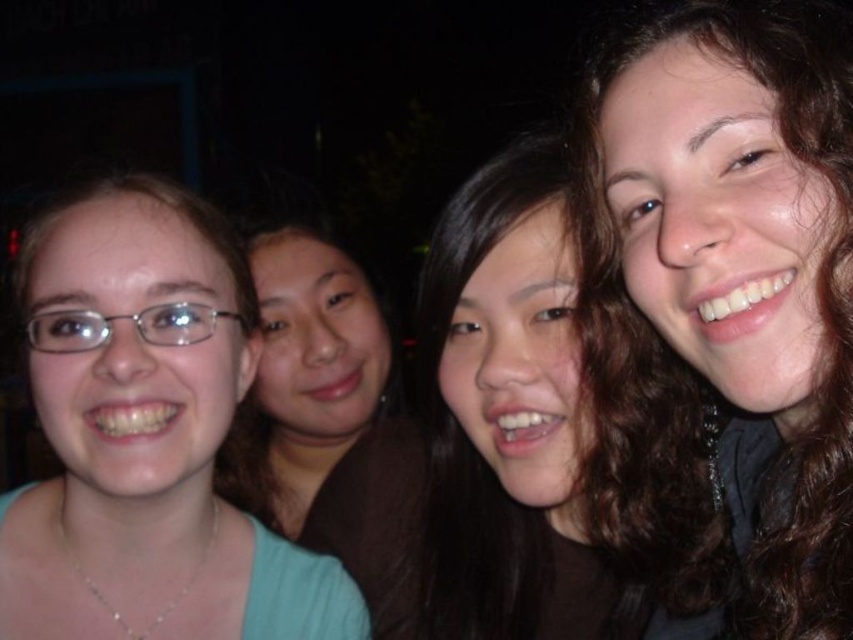
From the picture: You are a photographer trying to adjust the lighting for a group photo. You notice the clear plastic glasses at left and the brown curly hair at center. Which object is closer to the camera, and why?

The brown curly hair at center is closer to the camera than the clear plastic glasses at left because it is positioned in front of it.

Based on the scene description, which object is bigger between the dark brown hair at center and the clear plastic glasses at left?

The dark brown hair at center is larger in size compared to the clear plastic glasses at left according to the description.

Based on the scene description, can you determine the spatial relationship between the brown curly hair at center and the clear plastic glasses at left?

The brown curly hair at center is located below clear plastic glasses at left.